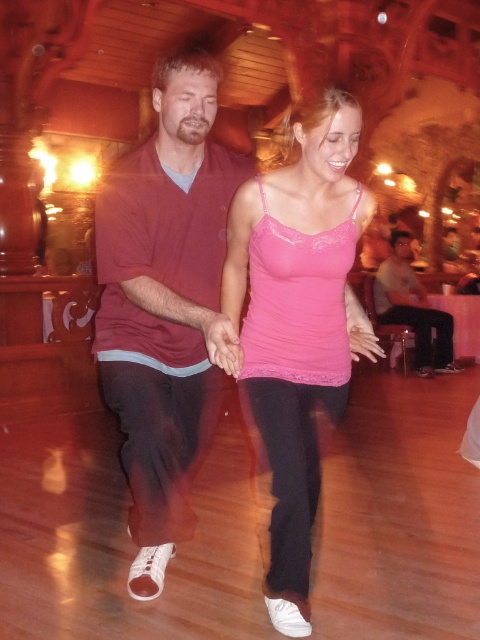
You are standing at the entrance of the dance hall and see two points marked in the scene. The first point is at coordinate point(x=175, y=131) and the second is at point(x=328, y=172). Which point is closer to you?

Point(x=175, y=131) is behind point(x=328, y=172), so the closer point to you is point(x=328, y=172).

In the dance hall scene, there is a matte maroon shirt at center located at point (165, 301). If you were standing at the origin point 0,0, which direction would you need to move to reach the matte maroon shirt at center?

To reach the matte maroon shirt at center located at point (165, 301) from the origin 0,0, you would need to move northeast since the x and y coordinates are both positive.

You are a photographer in the dance hall and want to capture a photo of both the matte maroon shirt at center and the pink lace tank top at center. Since you want to highlight the contrast between their colors, where should you position them in the frame?

The matte maroon shirt at center is positioned on the left side of pink lace tank top at center, so to highlight their color contrast, position the matte maroon shirt at center on the left and the pink lace tank top at center on the right in the frame.